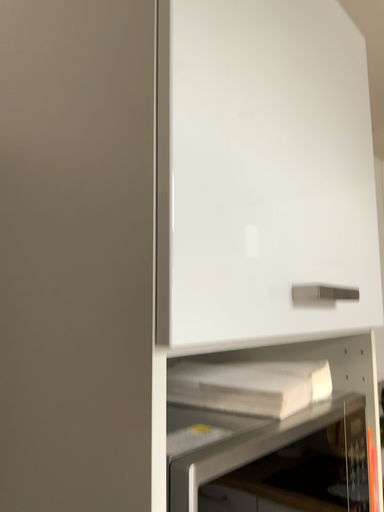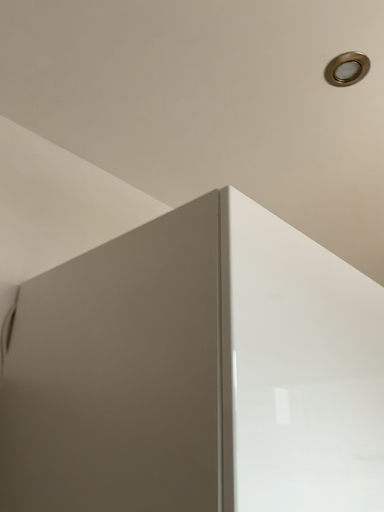
Question: Which way did the camera rotate in the video?

Choices:
 (A) rotated downward
 (B) rotated upward

Answer: (B)